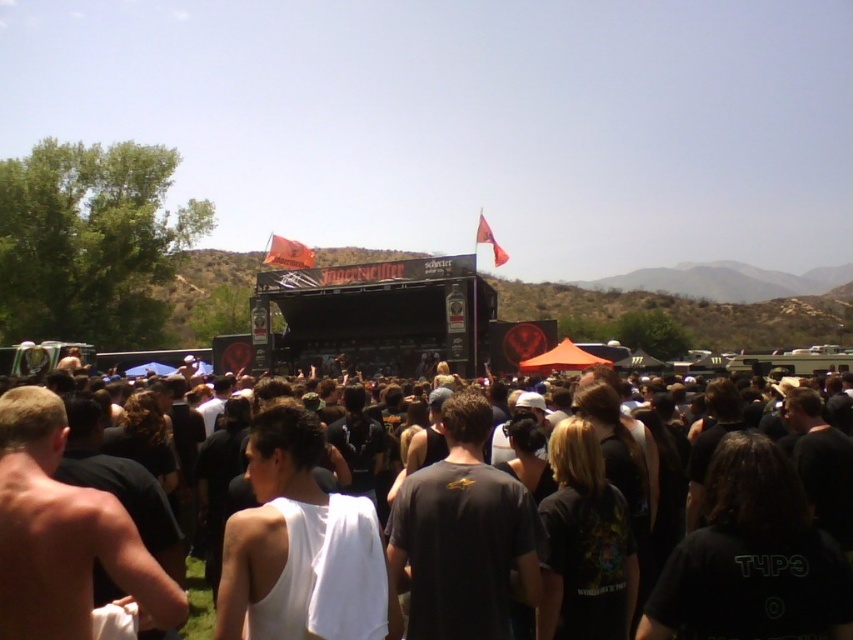
Measure the distance between point (132, 520) and camera.

Point (132, 520) and camera are 83.66 meters apart.

Which is more to the right, black fabric crowd at center or shiny skin torso at center?

black fabric crowd at center

Between point (264, 438) and point (28, 564), which one is positioned behind?

The point (264, 438) is more distant.

Find the location of a particular element. The width and height of the screenshot is (853, 640). black fabric crowd at center is located at coordinates (370, 545).